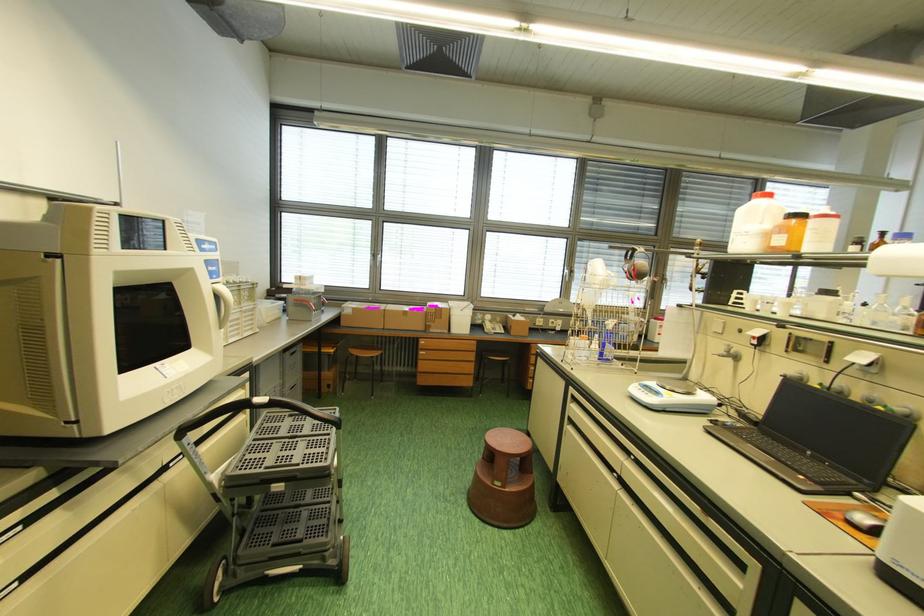
This screenshot has height=616, width=924. What do you see at coordinates (504, 480) in the screenshot?
I see `the brown step stool` at bounding box center [504, 480].